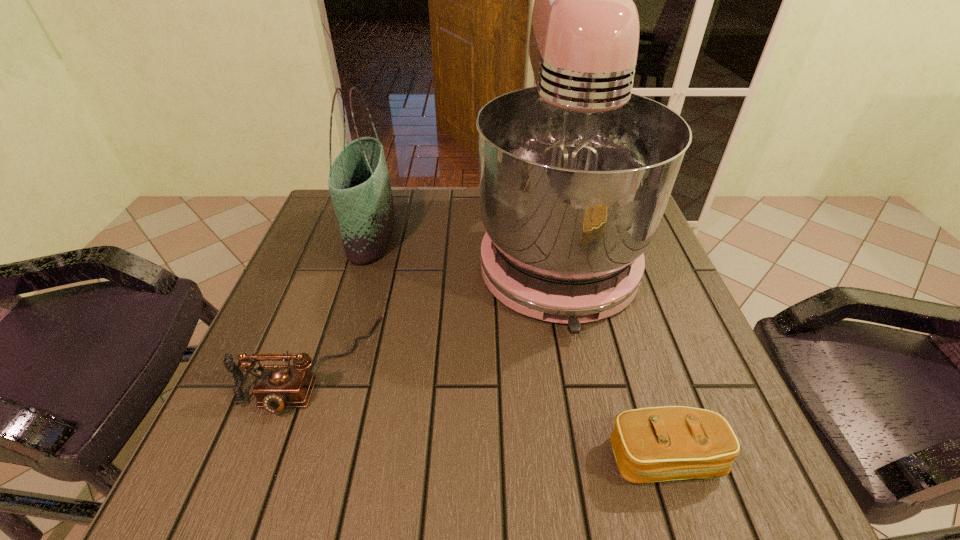
This screenshot has height=540, width=960. What are the coordinates of `vacant point at the left edge` in the screenshot? It's located at (316, 420).

You are a GUI agent. You are given a task and a screenshot of the screen. Output one action in this format:
    pyautogui.click(x=<x>, y=<y>)
    Task: Click on the free region at the right edge of the desktop
    
    Given the screenshot: What is the action you would take?
    pyautogui.click(x=709, y=357)

Locate an element on the screen. The width and height of the screenshot is (960, 540). vacant region between the third shortest object and the shortest object is located at coordinates (518, 346).

Where is `unoccupied position between the tote bag and the clutch bag`? The width and height of the screenshot is (960, 540). unoccupied position between the tote bag and the clutch bag is located at coordinates (518, 346).

Find the location of a particular element. blank region between the mixer and the shortest object is located at coordinates (611, 356).

You are a GUI agent. You are given a task and a screenshot of the screen. Output one action in this format:
    pyautogui.click(x=<x>, y=<y>)
    Task: Click on the empty space that is in between the second tallest object and the telephone
    
    Given the screenshot: What is the action you would take?
    pyautogui.click(x=342, y=299)

Locate an element on the screen. This screenshot has height=540, width=960. empty location between the tallest object and the second tallest object is located at coordinates (464, 244).

This screenshot has width=960, height=540. In order to click on vacant area that lies between the clutch bag and the mixer in this screenshot , I will do `click(611, 356)`.

Identify the location of blank region between the second shortest object and the shortest object. (489, 411).

You are a GUI agent. You are given a task and a screenshot of the screen. Output one action in this format:
    pyautogui.click(x=<x>, y=<y>)
    Task: Click on the free space between the tallest object and the tote bag
    The image size is (960, 540).
    Given the screenshot: What is the action you would take?
    pyautogui.click(x=464, y=244)